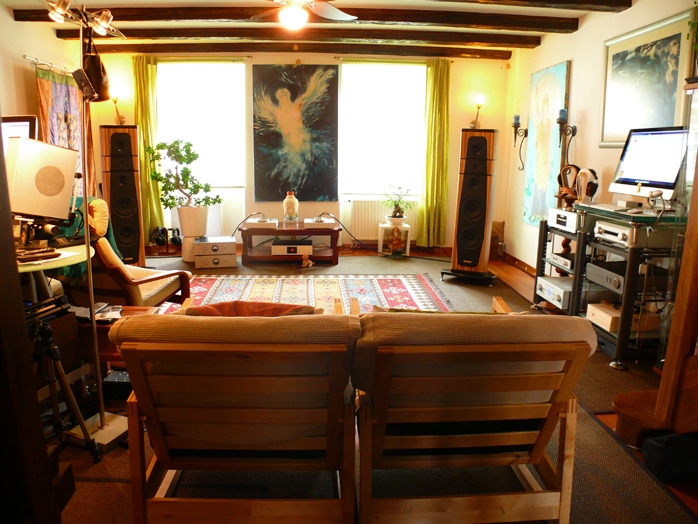
Locate an element on the screen. This screenshot has height=524, width=698. heating element is located at coordinates (357, 210).